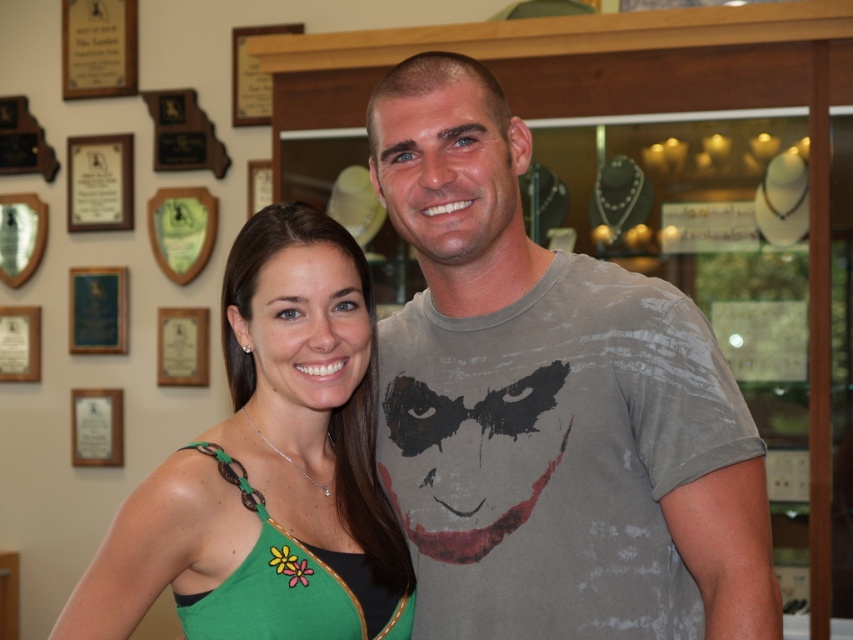
The image size is (853, 640). Find the location of `matte wood plaque at upper left`. matte wood plaque at upper left is located at coordinates (99, 182).

Measure the distance between point [83,173] and camera.

They are 4.41 meters apart.

This screenshot has width=853, height=640. Find the location of `matte wood plaque at upper left`. matte wood plaque at upper left is located at coordinates (99, 182).

Can you confirm if matte wood plaque at upper left is bigger than wooden plaque at upper left?

Incorrect, matte wood plaque at upper left is not larger than wooden plaque at upper left.

Is point (100, 205) farther from camera compared to point (248, 205)?

That is True.

Is point (80, 198) positioned after point (265, 170)?

Yes, point (80, 198) is behind point (265, 170).

Locate an element on the screen. This screenshot has width=853, height=640. matte wood plaque at upper left is located at coordinates (99, 182).

What do you see at coordinates (270, 456) in the screenshot?
I see `green fabric dress at center` at bounding box center [270, 456].

Who is taller, green fabric dress at center or green wood plaque at upper left?

green fabric dress at center is taller.

Locate an element on the screen. This screenshot has width=853, height=640. green fabric dress at center is located at coordinates (270, 456).

The height and width of the screenshot is (640, 853). I want to click on green fabric dress at center, so click(x=270, y=456).